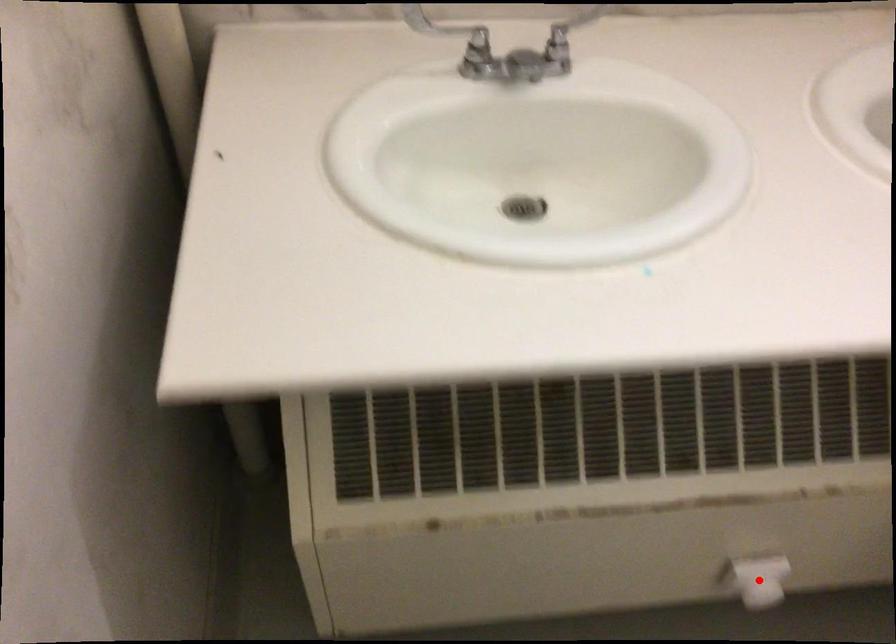
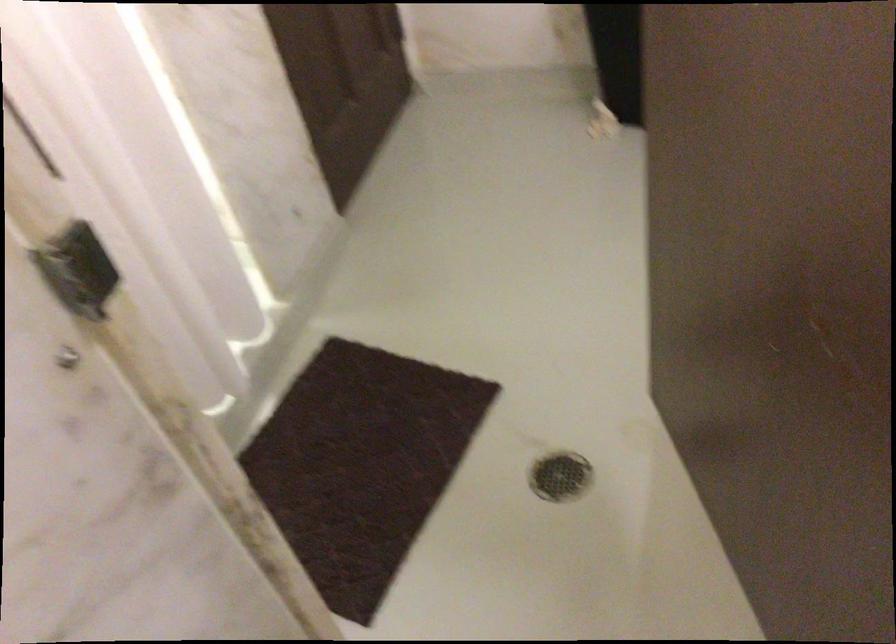
Question: I am providing you with two images of the same scene from different viewpoints. A red point is marked on the first image. Can you still see the location of the red point in image 2?

Choices:
 (A) Yes
 (B) No

Answer: (B)